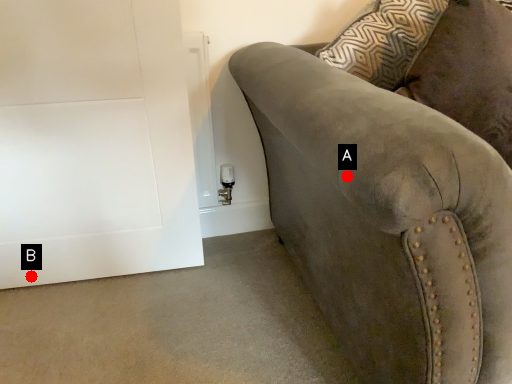
Question: Two points are circled on the image, labeled by A and B beside each circle. Which point is farther from the camera taking this photo?

Choices:
 (A) A is further
 (B) B is further

Answer: (B)